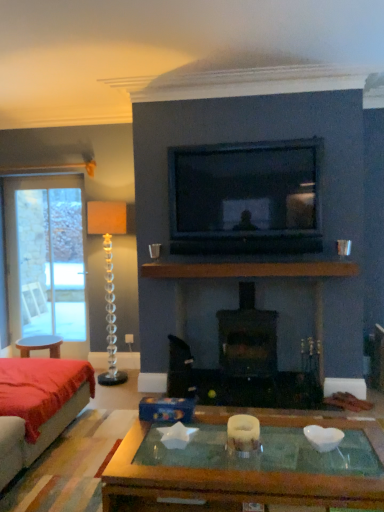
Question: Considering the relative sizes of white frosted glass candle holder at center, arranged as the second candle holder when viewed from the top, and black matte fireplace at center in the image provided, is white frosted glass candle holder at center, arranged as the second candle holder when viewed from the top, shorter than black matte fireplace at center?

Choices:
 (A) no
 (B) yes

Answer: (B)

Question: Is the position of white frosted glass candle holder at center, arranged as the second candle holder when viewed from the top, more distant than that of black matte fireplace at center?

Choices:
 (A) no
 (B) yes

Answer: (A)

Question: Is white frosted glass candle holder at center, which appears as the first candle holder when viewed from the right, to the left of black matte fireplace at center from the viewer's perspective?

Choices:
 (A) no
 (B) yes

Answer: (B)

Question: From a real-world perspective, is white frosted glass candle holder at center, the second candle holder in the left-to-right sequence, under black matte fireplace at center?

Choices:
 (A) yes
 (B) no

Answer: (A)

Question: Is white frosted glass candle holder at center, which is the second candle holder in back-to-front order, bigger than black matte fireplace at center?

Choices:
 (A) yes
 (B) no

Answer: (B)

Question: Would you consider white frosted glass candle holder at center, placed as the 1th candle holder when sorted from bottom to top, to be distant from black matte fireplace at center?

Choices:
 (A) yes
 (B) no

Answer: (A)

Question: From the image's perspective, is matte black television at upper center located beneath brown wooden mantle at center?

Choices:
 (A) no
 (B) yes

Answer: (A)

Question: Is matte black television at upper center shorter than brown wooden mantle at center?

Choices:
 (A) no
 (B) yes

Answer: (A)

Question: Can we say matte black television at upper center lies outside brown wooden mantle at center?

Choices:
 (A) yes
 (B) no

Answer: (A)

Question: Does matte black television at upper center appear on the left side of brown wooden mantle at center?

Choices:
 (A) yes
 (B) no

Answer: (A)

Question: From the image's perspective, would you say matte black television at upper center is positioned over brown wooden mantle at center?

Choices:
 (A) no
 (B) yes

Answer: (B)

Question: Does matte black television at upper center turn towards brown wooden mantle at center?

Choices:
 (A) yes
 (B) no

Answer: (B)

Question: Considering the relative sizes of velvet red couch at lower left and clear glass candle holder at left, which is the 1th candle holder from back to front, in the image provided, is velvet red couch at lower left taller than clear glass candle holder at left, which is the 1th candle holder from back to front,?

Choices:
 (A) yes
 (B) no

Answer: (B)